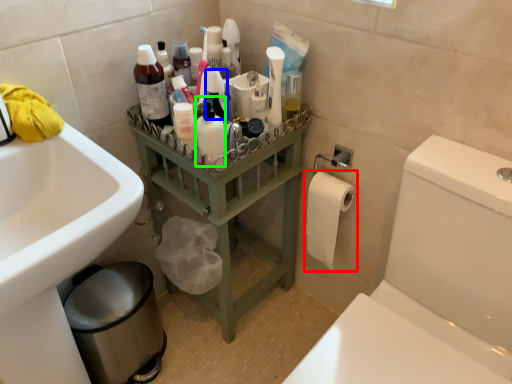
Question: Which is farther away from toilet paper (highlighted by a red box)? cleaning product (highlighted by a blue box) or toiletry (highlighted by a green box)?

Choices:
 (A) cleaning product
 (B) toiletry

Answer: (A)